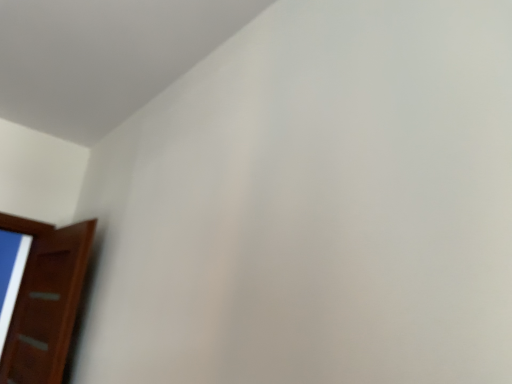
Describe the element at coordinates (46, 302) in the screenshot. This screenshot has height=384, width=512. I see `brown wooden door at left` at that location.

Image resolution: width=512 pixels, height=384 pixels. Find the location of `brown wooden door at left`. brown wooden door at left is located at coordinates [x=46, y=302].

This screenshot has height=384, width=512. Identify the location of brown wooden door at left. (46, 302).